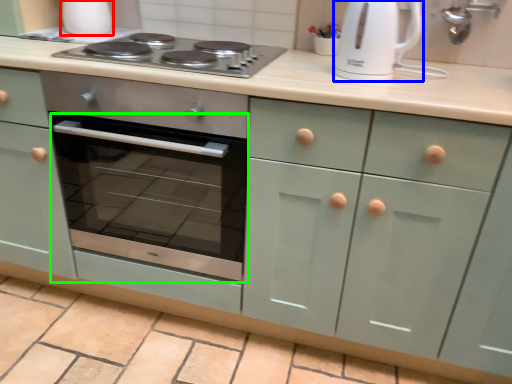
Question: Which object is the farthest from appliance (highlighted by a red box)? Choose among these: kitchen appliance (highlighted by a blue box) or oven (highlighted by a green box).

Choices:
 (A) kitchen appliance
 (B) oven

Answer: (A)